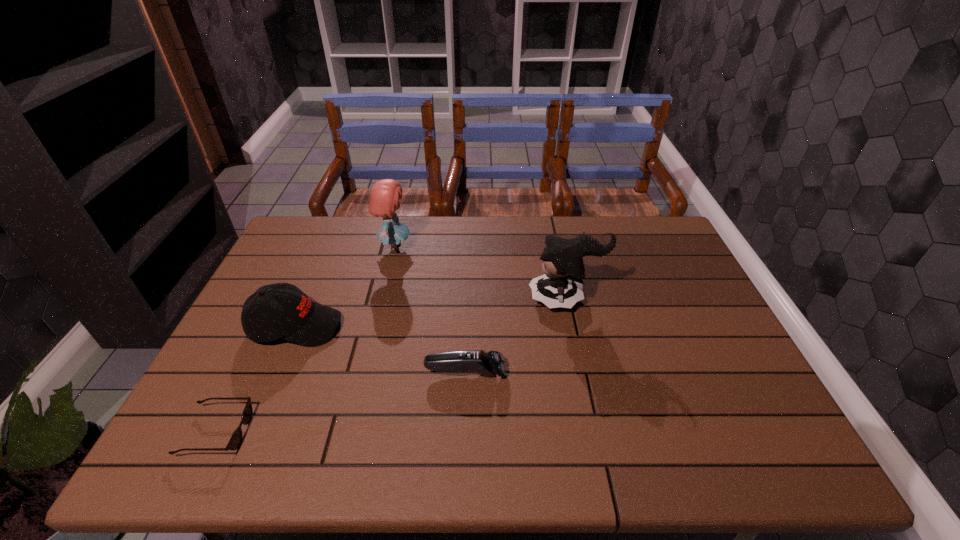
Where is `object that is at the near left corner`? This screenshot has height=540, width=960. object that is at the near left corner is located at coordinates (236, 438).

Locate an element on the screen. vacant space at the far edge is located at coordinates (418, 220).

This screenshot has height=540, width=960. Find the location of `vacant space at the near edge of the desktop`. vacant space at the near edge of the desktop is located at coordinates (538, 435).

This screenshot has height=540, width=960. Identify the location of free region at the right edge. (698, 395).

At what (x,y) coordinates should I click in order to perform the action: click on vacant space at the far left corner. Please return your answer as a coordinate pair (x, y). The image size is (960, 540). Looking at the image, I should click on (319, 228).

The height and width of the screenshot is (540, 960). In order to click on vacant space at the far right corner in this screenshot , I will do `click(663, 227)`.

Locate an element on the screen. The image size is (960, 540). free space that is in between the farther doll and the nearer doll is located at coordinates (480, 273).

Find the location of a particular element. The height and width of the screenshot is (540, 960). vacant area that lies between the farther doll and the electric shaver is located at coordinates (430, 310).

Where is `empty space that is in between the third tallest object and the sunglasses`? The height and width of the screenshot is (540, 960). empty space that is in between the third tallest object and the sunglasses is located at coordinates (256, 379).

Image resolution: width=960 pixels, height=540 pixels. Identify the location of free space between the left doll and the right doll. (480, 273).